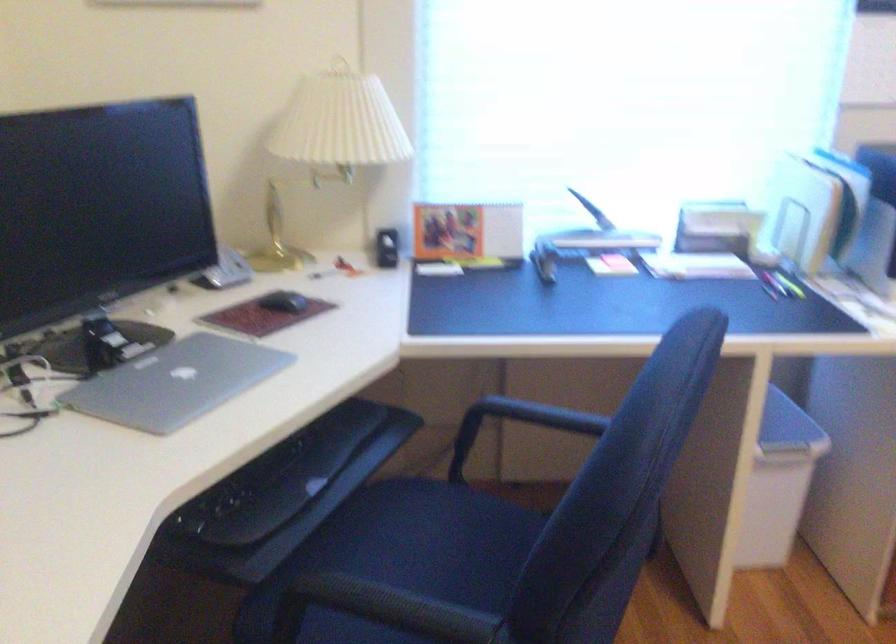
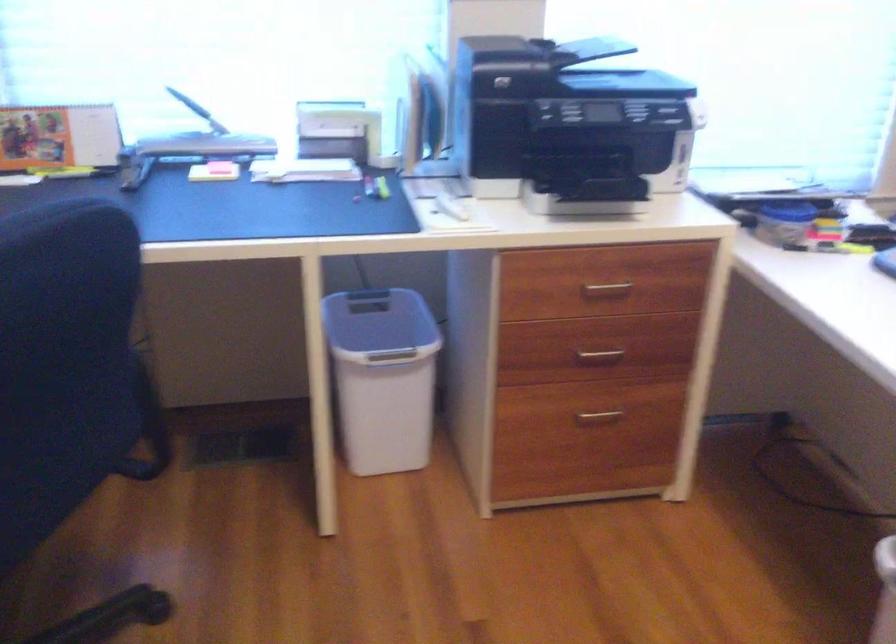
Question: Which direction would the cameraman need to move to produce the second image? Reply with the corresponding letter.

Choices:
 (A) Left
 (B) Right
 (C) Forward
 (D) Backward

Answer: (B)